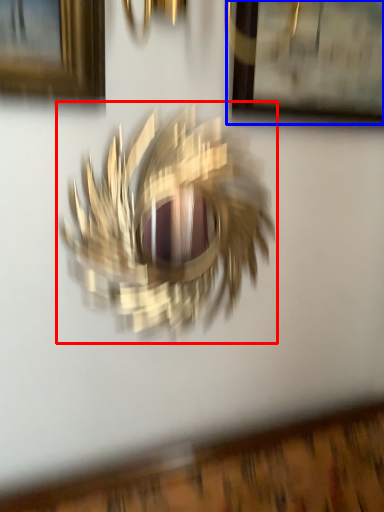
Question: Which object is closer to the camera taking this photo, bird (highlighted by a red box) or picture frame (highlighted by a blue box)?

Choices:
 (A) bird
 (B) picture frame

Answer: (A)